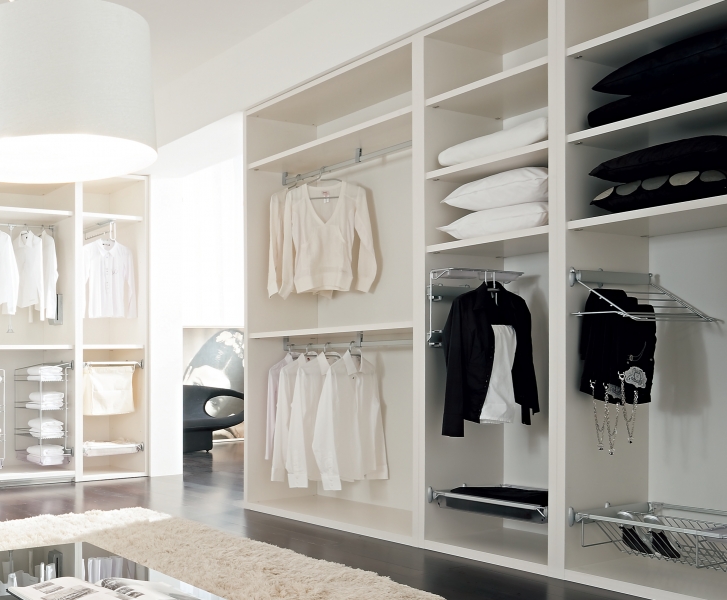
You are a GUI agent. You are given a task and a screenshot of the screen. Output one action in this format:
    pyautogui.click(x=<x>, y=<y>)
    Task: Click on the black pillows
    The width and height of the screenshot is (727, 600).
    Given the screenshot: What is the action you would take?
    pyautogui.click(x=667, y=154), pyautogui.click(x=640, y=66)